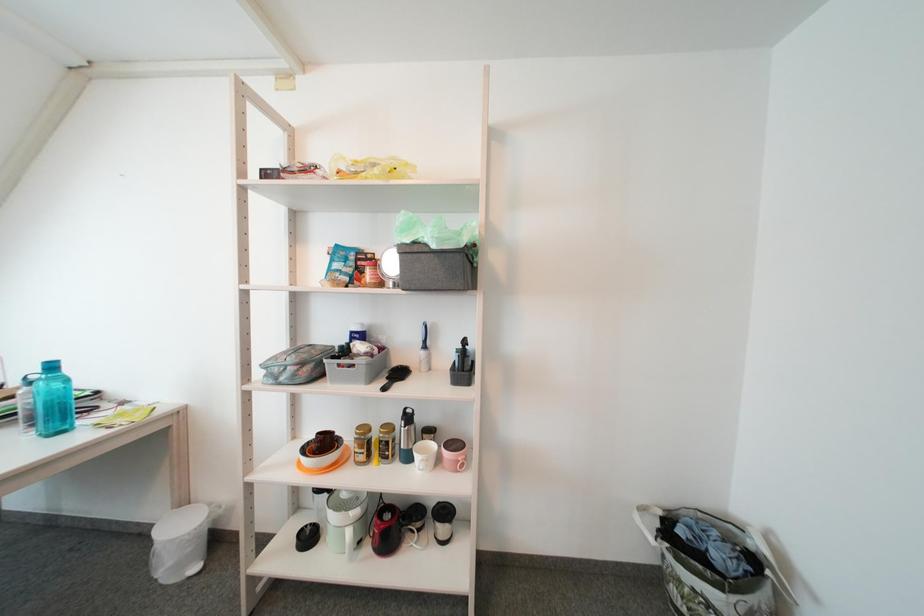
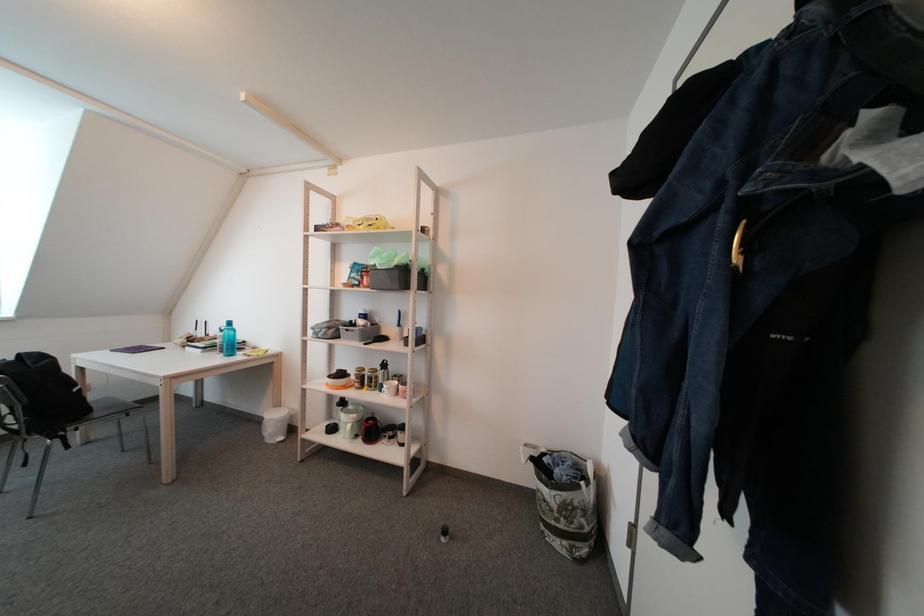
Question: The first image is from the beginning of the video and the second image is from the end. How did the camera likely rotate when shooting the video?

Choices:
 (A) Left
 (B) Right
 (C) Up
 (D) Down

Answer: (A)